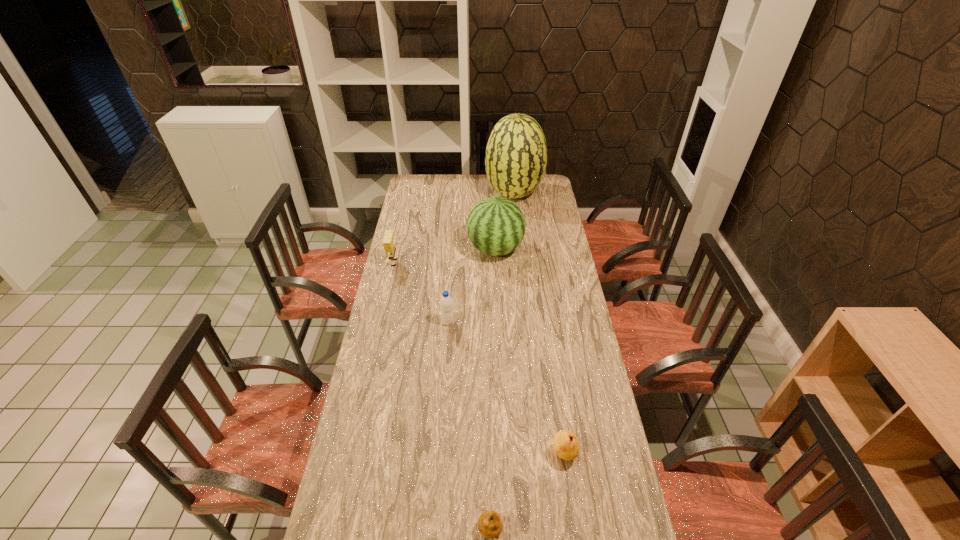
Locate an element on the screen. The image size is (960, 540). vacant area in the image that satisfies the following two spatial constraints: 1. on the face of the second object from left to right; 2. on the right side of the sponge is located at coordinates (383, 322).